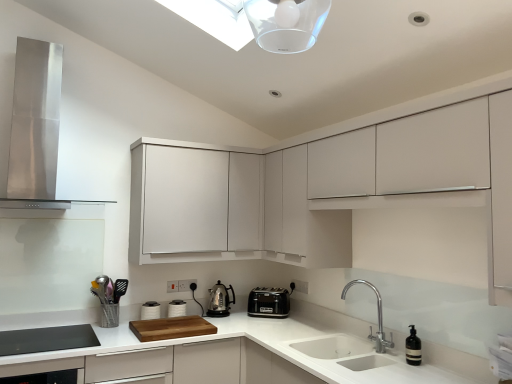
Identify the location of vacant space situated on the left part of polished stainless steel faucet at lower right. (328, 342).